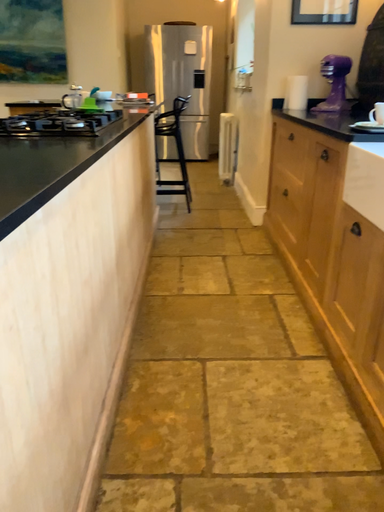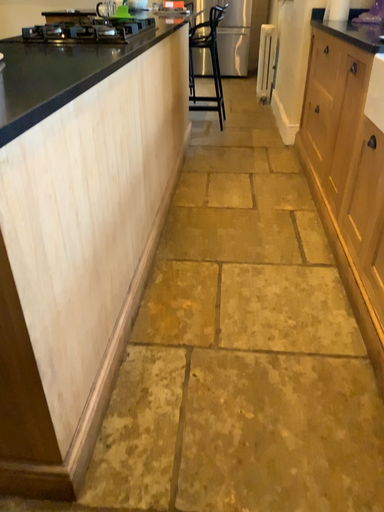
Question: How did the camera likely rotate when shooting the video?

Choices:
 (A) rotated upward
 (B) rotated downward

Answer: (B)